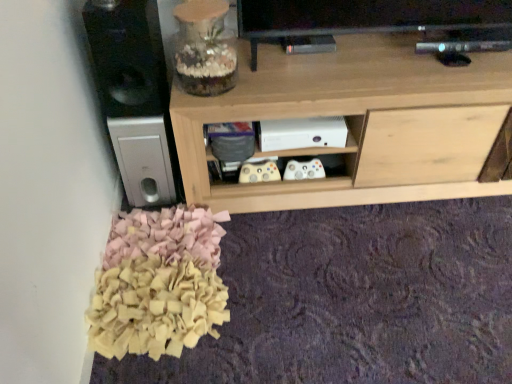
You are a GUI agent. You are given a task and a screenshot of the screen. Output one action in this format:
    pyautogui.click(x=<x>, y=<y>)
    Task: Click on the free location above light wood shelf at center (from a real-world perspective)
    This screenshot has height=384, width=512.
    Given the screenshot: What is the action you would take?
    pyautogui.click(x=376, y=58)